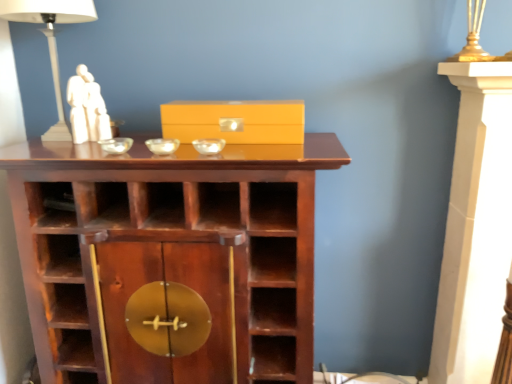
At what (x,y) coordinates should I click in order to perform the action: click on vacant region to the right of transparent glass bowl at center, the third glass bowl in the left-to-right sequence. Please return your answer as a coordinate pair (x, y). This screenshot has width=512, height=384. Looking at the image, I should click on (266, 140).